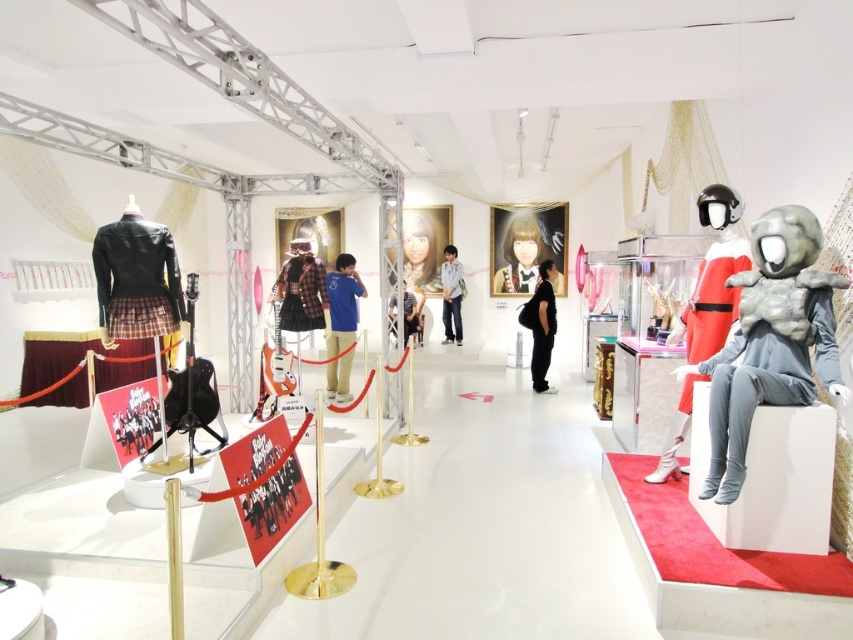
Question: Which is nearer to the red matte helmet at center?

Choices:
 (A) blue cotton shirt at center
 (B) gray matte alien costume at right

Answer: (B)

Question: Is blue cotton shirt at center further to camera compared to smooth glossy portrait at center?

Choices:
 (A) no
 (B) yes

Answer: (A)

Question: Is gray matte alien costume at right further to camera compared to smooth glossy portrait at center?

Choices:
 (A) no
 (B) yes

Answer: (A)

Question: Is plaid fabric skirt at center closer to the viewer compared to smooth glossy portrait at center?

Choices:
 (A) yes
 (B) no

Answer: (A)

Question: Which object is positioned farthest from the gray matte alien costume at right?

Choices:
 (A) blue cotton shirt at center
 (B) smooth glossy portrait at center
 (C) light gray fabric shirt at center

Answer: (B)

Question: Which of the following is the farthest from the observer?

Choices:
 (A) smooth glossy portrait at center
 (B) light gray fabric shirt at center
 (C) blue cotton shirt at center
 (D) leather jacket at left

Answer: (A)